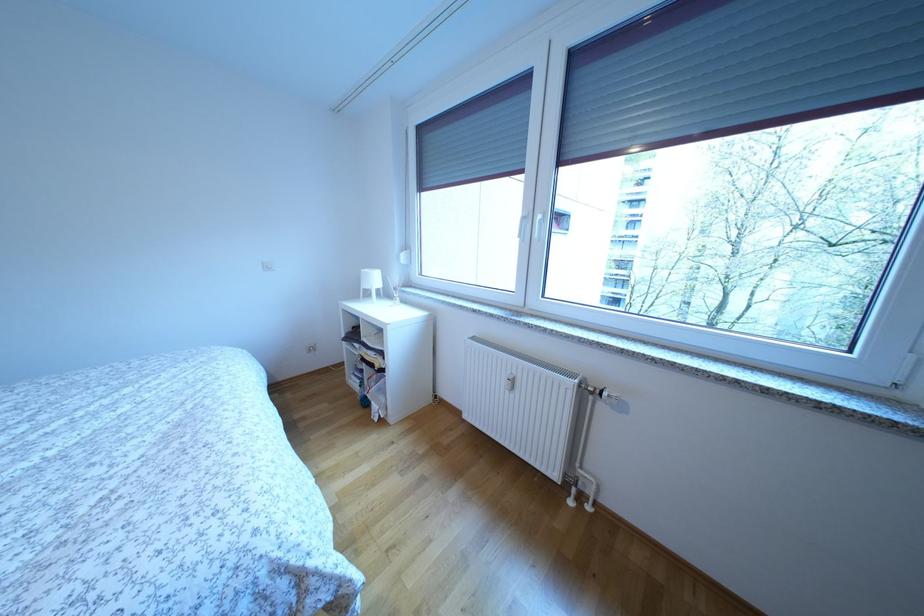
This screenshot has height=616, width=924. Find the location of `glass diffuser bottle`. glass diffuser bottle is located at coordinates (395, 299).